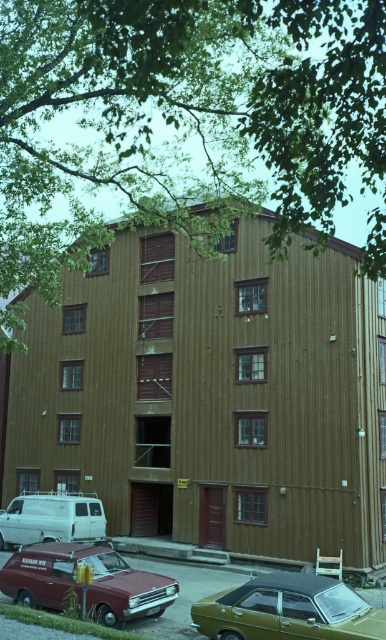
You are standing in front of the wooden building at center. There is a specific point marked at coordinates [211,396]. Based on the scene description, can you determine what part of the building this point corresponds to?

The point at [211,396] is on the wooden building at center.

You are a delivery person trying to park your vehicle in the parking lot near the building. You see a metallic gold car at lower center and a metallic red van at lower left. Which vehicle is blocking the parking spot closer to the building?

The metallic gold car at lower center is positioned over metallic red van at lower left, meaning the metallic gold car is closer to the building and blocking the parking spot.

You are standing in front of the multi story wooden building and see the point (289, 611). What object is located at this point?

The point (289, 611) corresponds to the metallic gold car at lower center.